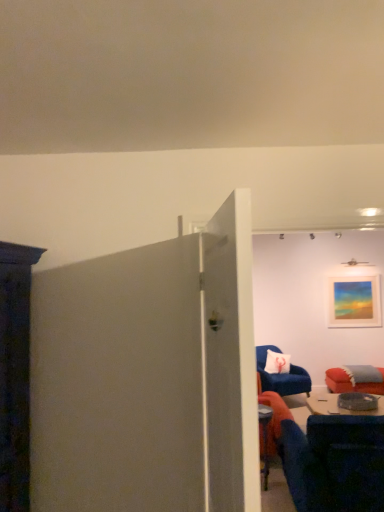
Question: Does blue fabric chair at lower right, which appears as the 2th chair when viewed from the back, come in front of matte acrylic painting at upper right?

Choices:
 (A) yes
 (B) no

Answer: (A)

Question: Is blue fabric chair at lower right, which appears as the 2th chair when viewed from the back, positioned behind matte acrylic painting at upper right?

Choices:
 (A) yes
 (B) no

Answer: (B)

Question: Is blue fabric chair at lower right, the first chair viewed from the front, bigger than matte acrylic painting at upper right?

Choices:
 (A) yes
 (B) no

Answer: (A)

Question: Considering the relative sizes of blue fabric chair at lower right, which appears as the 2th chair when viewed from the back, and matte acrylic painting at upper right in the image provided, is blue fabric chair at lower right, which appears as the 2th chair when viewed from the back, smaller than matte acrylic painting at upper right?

Choices:
 (A) no
 (B) yes

Answer: (A)

Question: Can you confirm if blue fabric chair at lower right, the first chair viewed from the front, is wider than matte acrylic painting at upper right?

Choices:
 (A) yes
 (B) no

Answer: (A)

Question: Considering the positions of matte acrylic painting at upper right and blue fabric chair at lower right, the first chair viewed from the front, in the image, is matte acrylic painting at upper right wider or thinner than blue fabric chair at lower right, the first chair viewed from the front,?

Choices:
 (A) wide
 (B) thin

Answer: (B)

Question: Is matte acrylic painting at upper right bigger or smaller than blue fabric chair at lower right, the first chair viewed from the front?

Choices:
 (A) small
 (B) big

Answer: (A)

Question: Considering the relative positions of matte acrylic painting at upper right and blue fabric chair at lower right, the first chair viewed from the front, in the image provided, is matte acrylic painting at upper right to the left or to the right of blue fabric chair at lower right, the first chair viewed from the front,?

Choices:
 (A) right
 (B) left

Answer: (A)

Question: From a real-world perspective, relative to blue fabric chair at lower right, the first chair viewed from the front, is matte acrylic painting at upper right vertically above or below?

Choices:
 (A) above
 (B) below

Answer: (A)

Question: From the image's perspective, relative to matte acrylic painting at upper right, is white glossy door at center above or below?

Choices:
 (A) above
 (B) below

Answer: (A)

Question: Looking at the image, does white glossy door at center seem bigger or smaller compared to matte acrylic painting at upper right?

Choices:
 (A) small
 (B) big

Answer: (B)

Question: Is point (208, 424) positioned closer to the camera than point (367, 292)?

Choices:
 (A) closer
 (B) farther

Answer: (A)

Question: Would you say white glossy door at center is to the left or to the right of matte acrylic painting at upper right in the picture?

Choices:
 (A) left
 (B) right

Answer: (A)

Question: Is matte acrylic painting at upper right to the left or to the right of white glossy door at center in the image?

Choices:
 (A) left
 (B) right

Answer: (B)

Question: From the image's perspective, is matte acrylic painting at upper right positioned above or below white glossy door at center?

Choices:
 (A) below
 (B) above

Answer: (A)